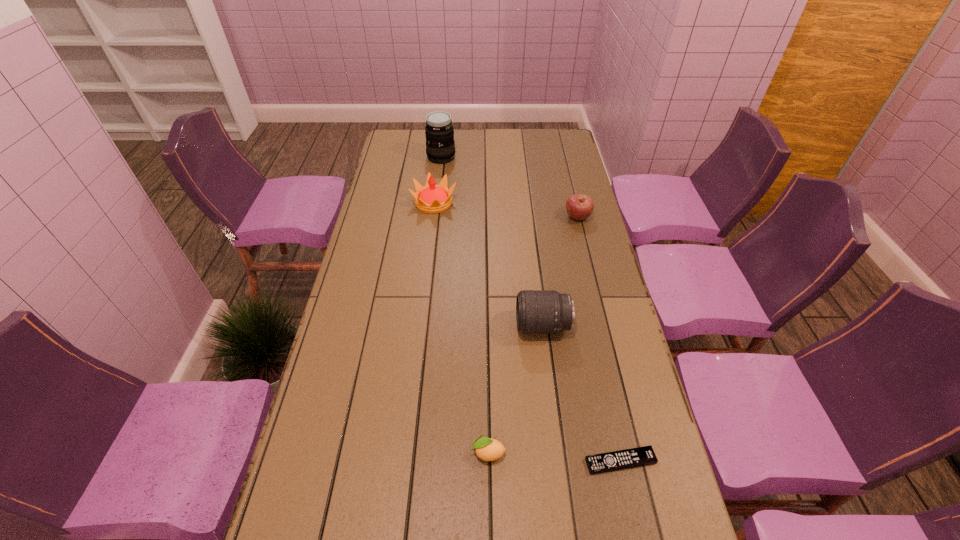
You are a GUI agent. You are given a task and a screenshot of the screen. Output one action in this format:
    pyautogui.click(x=<x>, y=<y>)
    Task: Click on the left telephoto lens
    
    Given the screenshot: What is the action you would take?
    pyautogui.click(x=440, y=147)

Identify the location of the farthest object. (440, 147).

The width and height of the screenshot is (960, 540). I want to click on crown, so click(432, 198).

You are a GUI agent. You are given a task and a screenshot of the screen. Output one action in this format:
    pyautogui.click(x=<x>, y=<y>)
    Task: Click on the shorter telephoto lens
    The height and width of the screenshot is (540, 960).
    Given the screenshot: What is the action you would take?
    pyautogui.click(x=537, y=312)

Where is `the nearer telephoto lens`? Image resolution: width=960 pixels, height=540 pixels. the nearer telephoto lens is located at coordinates point(537,312).

This screenshot has width=960, height=540. Find the location of `the third shortest object`. the third shortest object is located at coordinates (579, 207).

Where is `the second shortest object`? the second shortest object is located at coordinates (487, 449).

Locate an element on the screen. The width and height of the screenshot is (960, 540). the third object from left to right is located at coordinates (487, 449).

At what (x,y) coordinates should I click in order to perform the action: click on the shortest object. Please return your answer as a coordinate pair (x, y). Image resolution: width=960 pixels, height=540 pixels. Looking at the image, I should click on (640, 456).

Image resolution: width=960 pixels, height=540 pixels. What are the coordinates of `free point located 0.350m on the front of the left telephoto lens` in the screenshot? It's located at (435, 214).